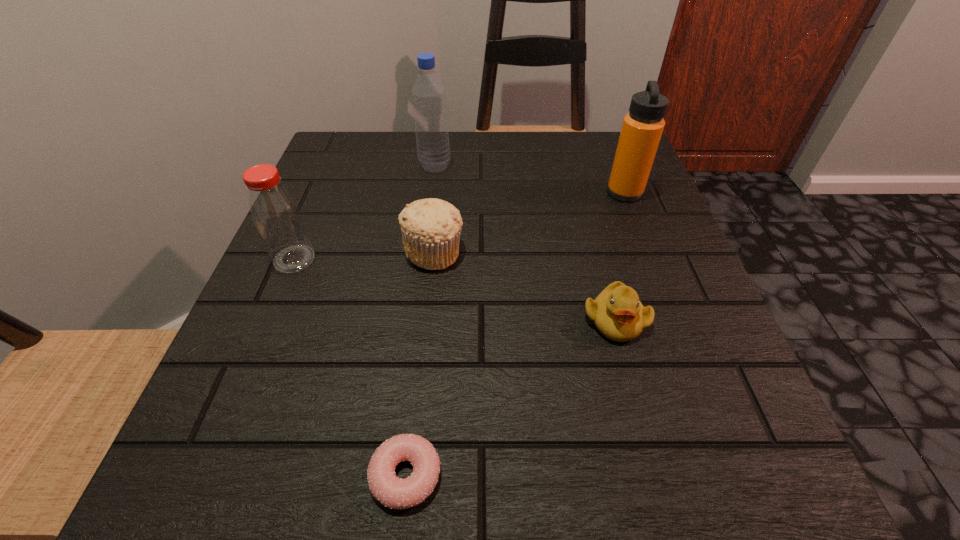
This screenshot has height=540, width=960. In order to click on the farther bottle in this screenshot , I will do `click(429, 98)`.

Find the location of a particular element. This screenshot has height=540, width=960. the farthest object is located at coordinates (x=429, y=98).

Identify the location of thermos bottle. The height and width of the screenshot is (540, 960). [642, 128].

Find the location of `the rightmost object`. the rightmost object is located at coordinates (642, 128).

Where is `the fourth shortest object`? This screenshot has height=540, width=960. the fourth shortest object is located at coordinates (276, 215).

The image size is (960, 540). In order to click on the left bottle in this screenshot , I will do `click(276, 215)`.

Where is `the fourth tallest object`? the fourth tallest object is located at coordinates (430, 228).

Where is `duckling`? duckling is located at coordinates (617, 313).

This screenshot has width=960, height=540. I want to click on the second nearest object, so click(x=617, y=313).

At what (x,y) coordinates should I click in order to perform the action: click on the shortest object. Please return your answer as a coordinate pair (x, y). The width and height of the screenshot is (960, 540). Looking at the image, I should click on (391, 491).